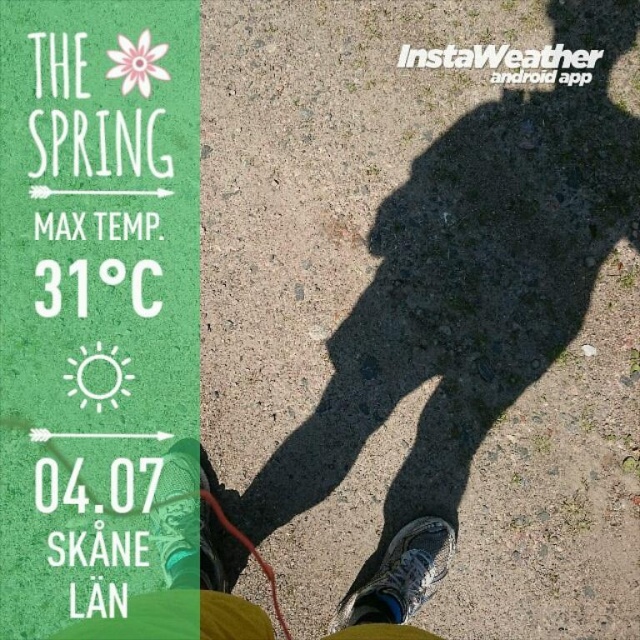
You are planning to wear the gray fabric pants at lower center and the white mesh shoe at lower center for an outdoor activity. Based on their sizes, which one might be more comfortable for walking long distances?

The gray fabric pants at lower center has a larger size compared to the white mesh shoe at lower center, so the gray fabric pants at lower center might be more comfortable for walking long distances due to their larger size providing more space and flexibility.

Consider the image. You are looking at a weather app interface. On the left side, you can see the weather information for Skane Lan, Sweden, including the temperature and date. On the right side, there is a point at coordinates (397,582). What object is located at this point?

The point at coordinates (397,582) corresponds to gray fabric pants at lower center.

You are looking at an image that shows both the gray fabric pants at lower center and the white mesh shoe at lower center. Which object is positioned more to the left?

The gray fabric pants at lower center is positioned more to the left than the white mesh shoe at lower center.